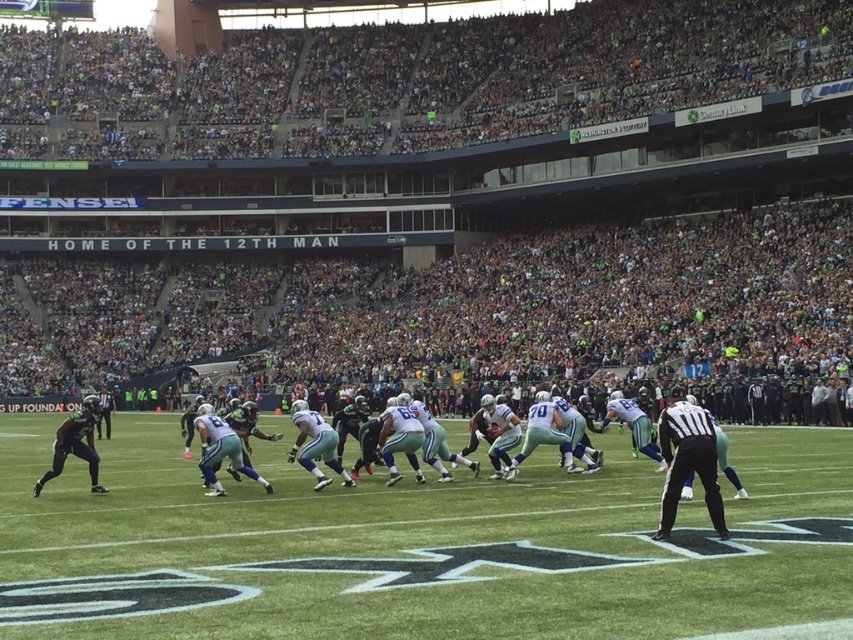
You are a photographer standing at the center of the stadium, and you want to take a photo that includes both point (154, 566) and point (662, 422). Which point will appear closer to the bottom edge of the photo?

Point (154, 566) is closer to the camera than point (662, 422), so in the photo, point (154, 566) will appear closer to the bottom edge of the photo.

You are a player wearing the black uniform at right. You need to get to the white turf at center to make a play. Which direction should you move?

The white turf at center is in front of the black uniform at right, so the player should move forward towards the white turf at center.